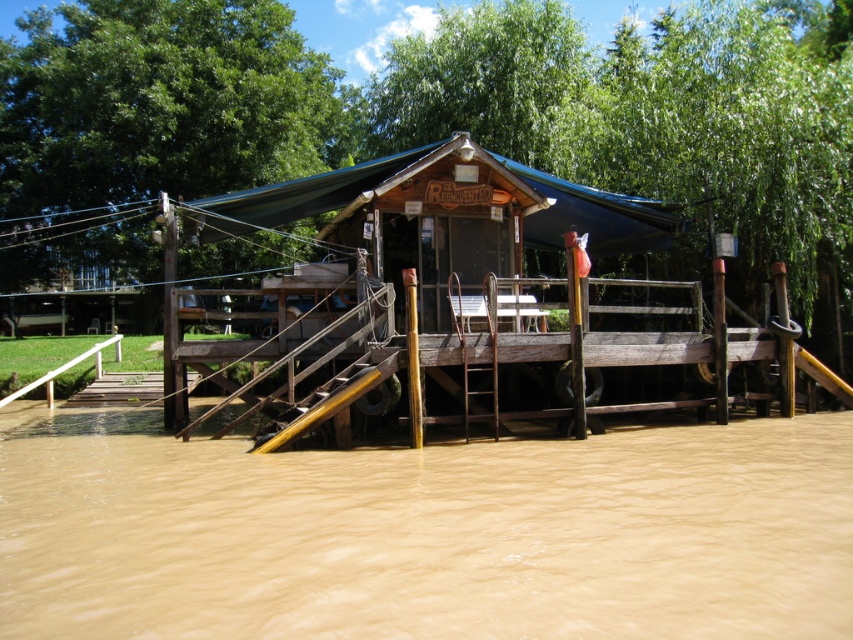
Is brown muddy water at lower center taller than blue tarpaulin canopy at center?

No, brown muddy water at lower center is not taller than blue tarpaulin canopy at center.

Describe the element at coordinates (430, 534) in the screenshot. This screenshot has height=640, width=853. I see `brown muddy water at lower center` at that location.

Image resolution: width=853 pixels, height=640 pixels. Describe the element at coordinates (430, 534) in the screenshot. I see `brown muddy water at lower center` at that location.

At what (x,y) coordinates should I click in order to perform the action: click on brown muddy water at lower center. Please return your answer as a coordinate pair (x, y). The width and height of the screenshot is (853, 640). Looking at the image, I should click on (430, 534).